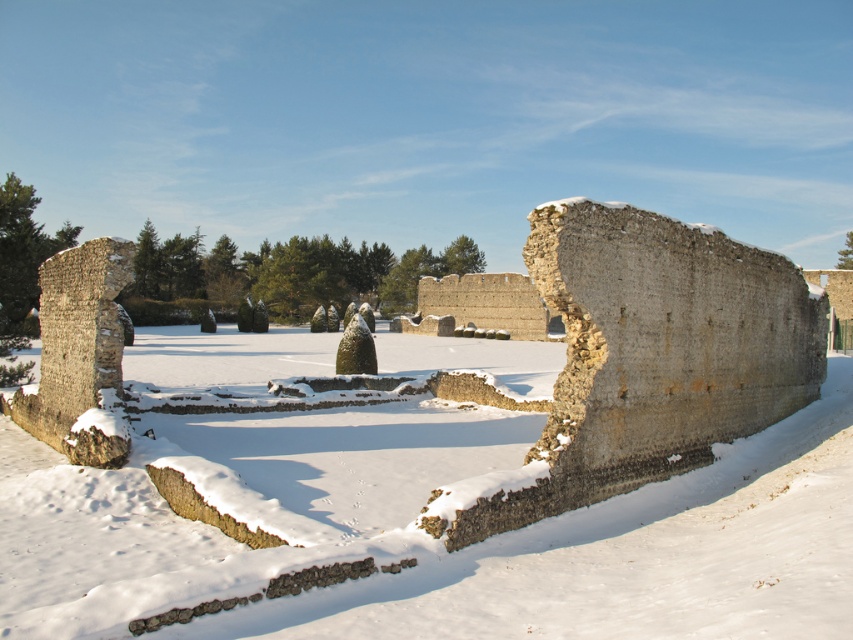
You are an archaeologist examining the snowy ruins. You see the white powdery snow at center and the rustic stone wall at center. Which object is positioned to the left when viewed from your perspective?

The white powdery snow at center is to the left of rustic stone wall at center.

You are standing at the edge of the snowy landscape and want to place a small flag exactly at the center of the white powdery snow at center. According to the coordinates provided, where should you place the flag?

The white powdery snow at center is located at coordinates point (430,540), so you should place the flag at point (430,540) to mark its center.

You are standing at the viewpoint of the image and want to walk to the point marked as point (576, 632). If your walking speed is 1.2 meters per second, how many seconds will it take you to reach that point?

The distance between the viewer and point (576, 632) is 18.51 meters. At a speed of 1.2 meters per second, it will take 18.51 divided by 1.2, which equals approximately 15.43 seconds to reach the point.